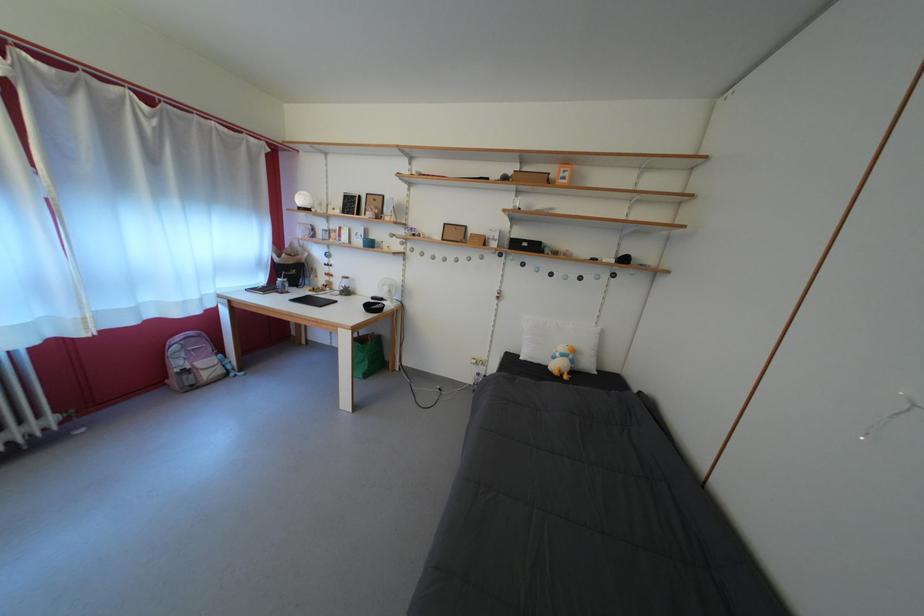
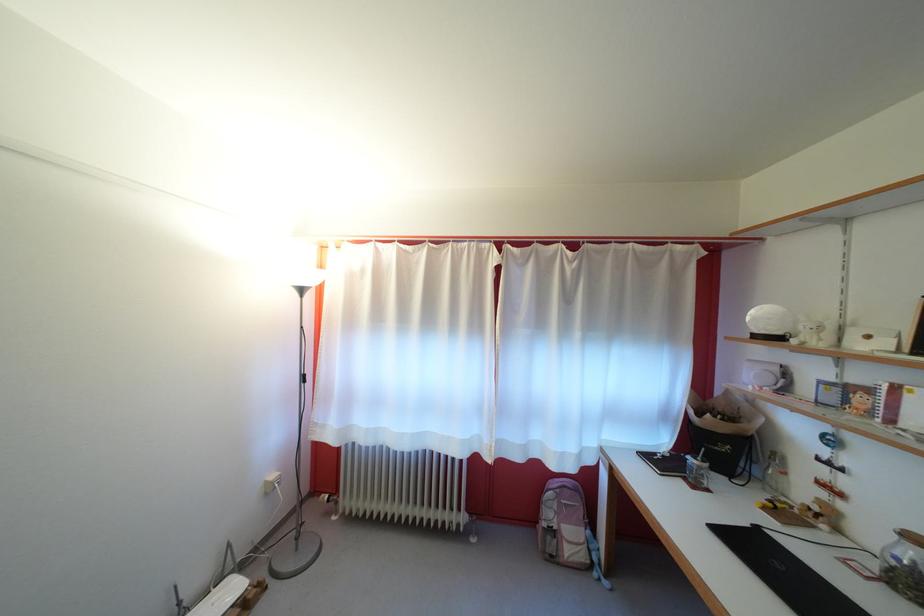
Find the pixel in the second image that matches (346,299) in the first image.

(881, 570)